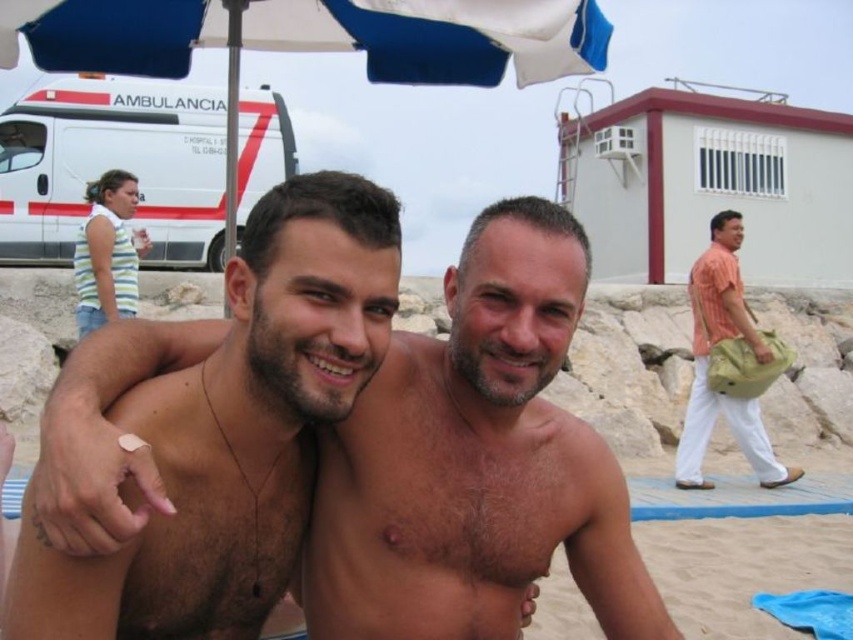
Does point (527, 561) come farther from viewer compared to point (405, 17)?

No, (527, 561) is closer to viewer.

Can you confirm if brown hair at center is shorter than blue fabric umbrella at upper center?

Incorrect, brown hair at center's height does not fall short of blue fabric umbrella at upper center's.

This screenshot has height=640, width=853. What are the coordinates of `brown hair at center` in the screenshot? It's located at (476, 461).

Find the location of a particular element. This screenshot has width=853, height=640. brown hair at center is located at coordinates (476, 461).

Is brown hair at center shorter than white glossy ambulance at upper left?

Correct, brown hair at center is not as tall as white glossy ambulance at upper left.

This screenshot has height=640, width=853. What are the coordinates of `brown hair at center` in the screenshot? It's located at (476, 461).

How much distance is there between brown hair at center and orange cotton shirt at right?

A distance of 22.30 feet exists between brown hair at center and orange cotton shirt at right.

Is brown hair at center thinner than orange cotton shirt at right?

Correct, brown hair at center's width is less than orange cotton shirt at right's.

The height and width of the screenshot is (640, 853). What are the coordinates of `brown hair at center` in the screenshot? It's located at 476,461.

I want to click on brown hair at center, so click(x=476, y=461).